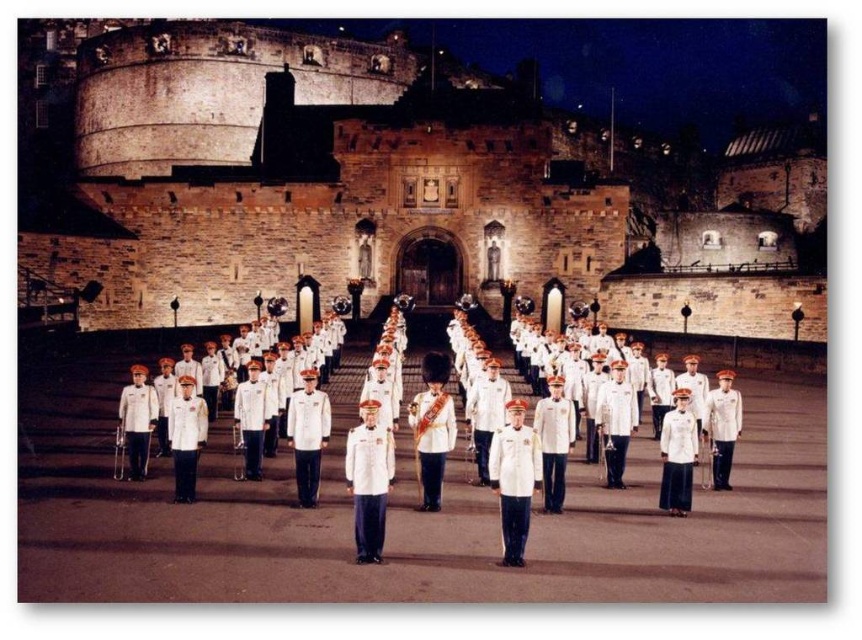
Is matte white uniform at center below white uniformed band at center?

Incorrect, matte white uniform at center is not positioned below white uniformed band at center.

Is point (142, 180) closer to viewer compared to point (248, 358)?

No, it is behind (248, 358).

This screenshot has width=862, height=640. Find the location of `matte white uniform at center`. matte white uniform at center is located at coordinates (384, 186).